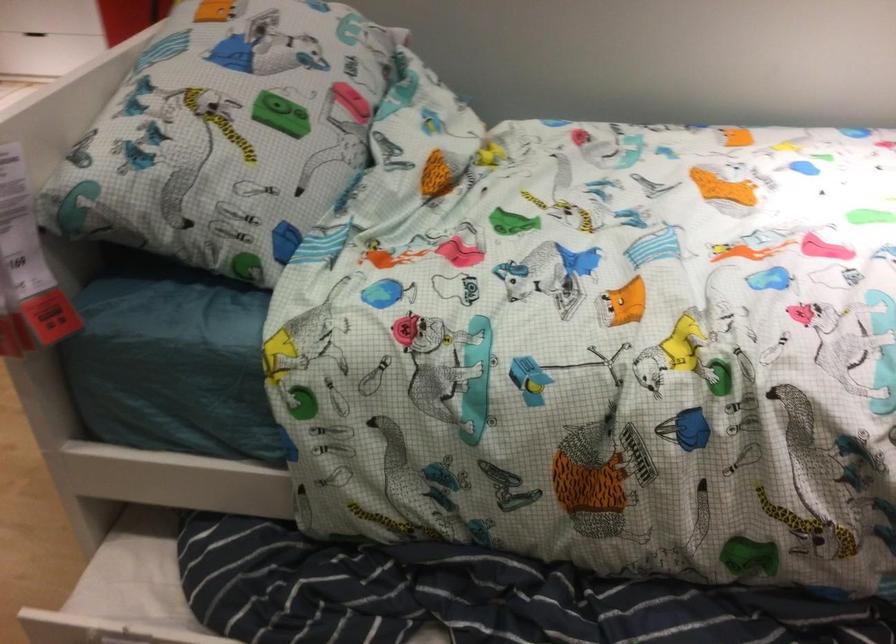
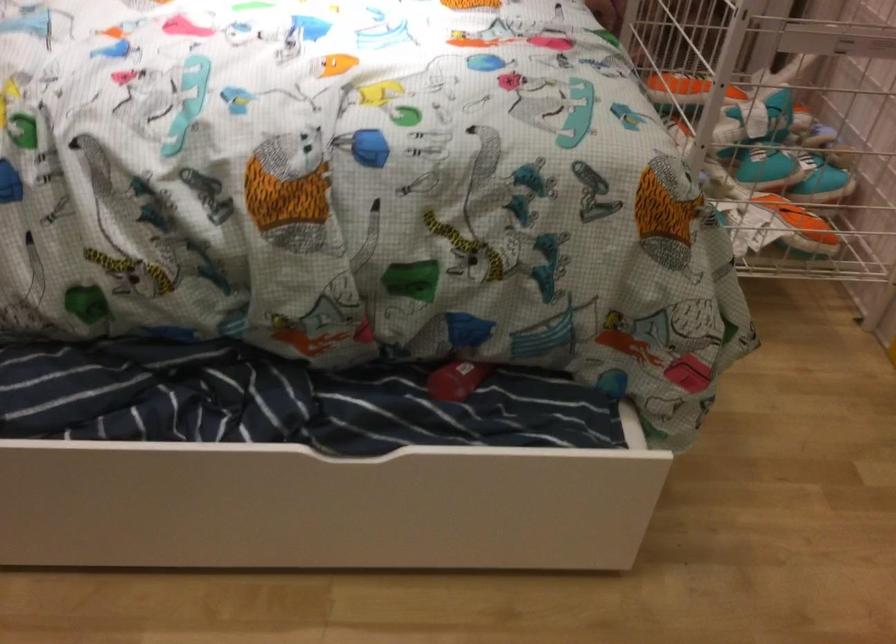
Consider the image. Which direction would the cameraman need to move to produce the second image?

The cameraman walked toward right, backward.